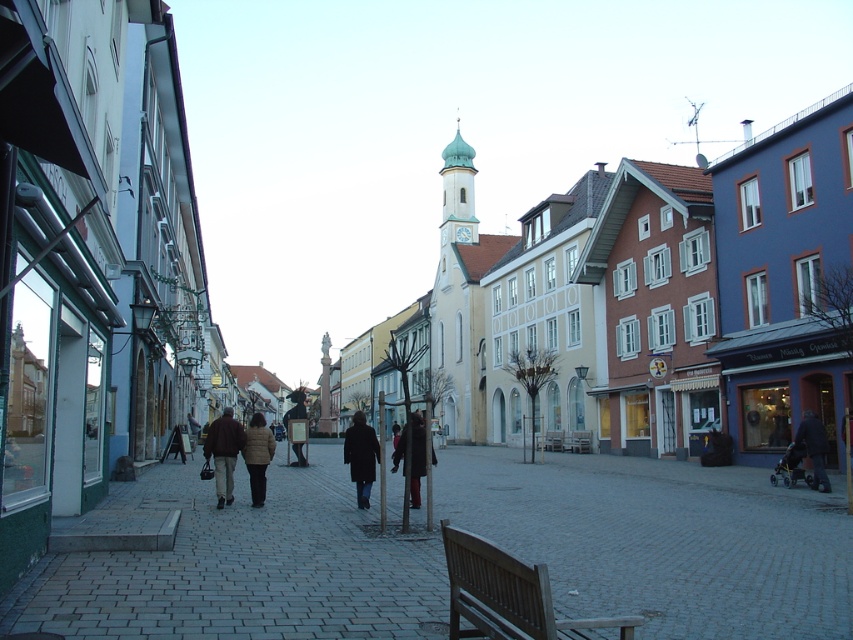
Based on the photo, you are a tourist standing on the European street and see the brown leather jacket at center. If you want to take a photo of it from the left side, which direction should you move? Please respond with either left, right, forward, or backward.

To take a photo of the brown leather jacket at center from its left side, you should move to your right. This will position you to the left of the jacket relative to its current location.